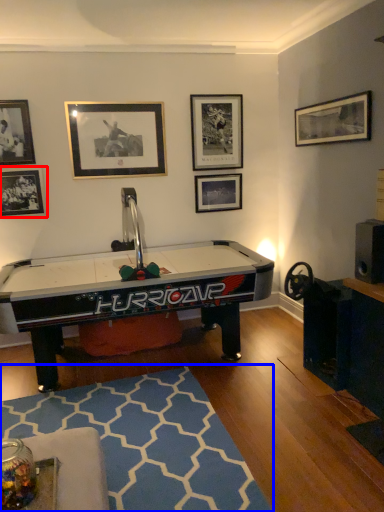
Question: Among these objects, which one is nearest to the camera, picture frame (highlighted by a red box) or mat (highlighted by a blue box)?

Choices:
 (A) picture frame
 (B) mat

Answer: (B)